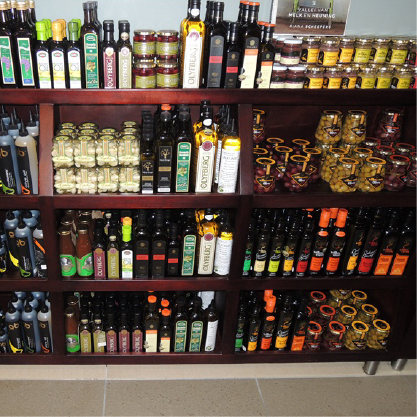
The height and width of the screenshot is (417, 417). I want to click on tile flooring, so click(x=129, y=396), click(x=32, y=396), click(x=304, y=396).